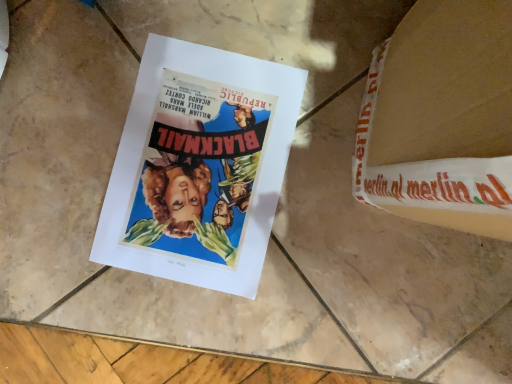
What do you see at coordinates (441, 118) in the screenshot? Image resolution: width=512 pixels, height=384 pixels. I see `white cardboard at upper right` at bounding box center [441, 118].

Where is `white cardboard at upper right`? The image size is (512, 384). white cardboard at upper right is located at coordinates (441, 118).

Describe the element at coordinates (199, 166) in the screenshot. I see `matte paper poster at center` at that location.

Based on the photo, what is the approximate height of matte paper poster at center?

It is 0.73 inches.

At what (x,y) coordinates should I click in order to perform the action: click on matte paper poster at center. Please return your answer as a coordinate pair (x, y). Looking at the image, I should click on (199, 166).

At what (x,y) coordinates should I click in order to perform the action: click on white cardboard at upper right. Please return your answer as a coordinate pair (x, y). This screenshot has height=384, width=512. Looking at the image, I should click on 441,118.

Considering the relative positions of matte paper poster at center and white cardboard at upper right in the image provided, is matte paper poster at center to the left or to the right of white cardboard at upper right?

matte paper poster at center is positioned on white cardboard at upper right's left side.

Is matte paper poster at center closer to the viewer compared to white cardboard at upper right?

No, it is behind white cardboard at upper right.

Is point (170, 107) closer to viewer compared to point (451, 149)?

No, it is behind (451, 149).

From the picture: From the image's perspective, is matte paper poster at center above white cardboard at upper right?

No, from the image's perspective, matte paper poster at center is not over white cardboard at upper right.

From a real-world perspective, between matte paper poster at center and white cardboard at upper right, who is vertically lower?

From a 3D spatial view, matte paper poster at center is below.

Considering the sizes of matte paper poster at center and white cardboard at upper right in the image, is matte paper poster at center wider or thinner than white cardboard at upper right?

matte paper poster at center is thinner than white cardboard at upper right.

Who is taller, matte paper poster at center or white cardboard at upper right?

white cardboard at upper right.

In the scene shown: Between matte paper poster at center and white cardboard at upper right, which one has smaller size?

matte paper poster at center is smaller.

Is matte paper poster at center inside the boundaries of white cardboard at upper right, or outside?

matte paper poster at center is located beyond the bounds of white cardboard at upper right.

From the picture: Is matte paper poster at center next to white cardboard at upper right and touching it?

No, matte paper poster at center is not next to white cardboard at upper right.

Is matte paper poster at center positioned with its back to white cardboard at upper right?

matte paper poster at center is not turned away from white cardboard at upper right.

How many degrees apart are the facing directions of matte paper poster at center and white cardboard at upper right?

2.58 degrees separate the facing orientations of matte paper poster at center and white cardboard at upper right.

How far apart are matte paper poster at center and white cardboard at upper right?

They are 7.97 inches apart.

The image size is (512, 384). I want to click on paperback book located above the matte paper poster at center (from the image's perspective), so click(441, 118).

Between white cardboard at upper right and matte paper poster at center, which one appears on the right side from the viewer's perspective?

Positioned to the right is white cardboard at upper right.

Is white cardboard at upper right behind matte paper poster at center?

No, white cardboard at upper right is in front of matte paper poster at center.

Between point (446, 22) and point (286, 139), which one is positioned in front?

The point (446, 22) is closer to the camera.

From the image's perspective, is white cardboard at upper right beneath matte paper poster at center?

No, from the image's perspective, white cardboard at upper right is not below matte paper poster at center.

From a real-world perspective, which object rests below the other?

From a 3D spatial view, matte paper poster at center is below.

Which of these two, white cardboard at upper right or matte paper poster at center, is thinner?

matte paper poster at center is thinner.

Considering the sizes of objects white cardboard at upper right and matte paper poster at center in the image provided, who is taller, white cardboard at upper right or matte paper poster at center?

With more height is white cardboard at upper right.

Who is bigger, white cardboard at upper right or matte paper poster at center?

Bigger between the two is white cardboard at upper right.

Could matte paper poster at center be considered to be inside white cardboard at upper right?

Actually, matte paper poster at center is outside white cardboard at upper right.

Is white cardboard at upper right not near matte paper poster at center?

They are positioned close to each other.

Consider the image. Is matte paper poster at center at the back of white cardboard at upper right?

That's not correct — white cardboard at upper right is not looking away from matte paper poster at center.

How many degrees apart are the facing directions of white cardboard at upper right and matte paper poster at center?

The angular difference between white cardboard at upper right and matte paper poster at center is 2.58 degrees.

Find the location of a particular element. paperback book lying above the matte paper poster at center (from the image's perspective) is located at coordinates (441, 118).

At what (x,y) coordinates should I click in order to perform the action: click on paperback book in front of the matte paper poster at center. Please return your answer as a coordinate pair (x, y). The width and height of the screenshot is (512, 384). Looking at the image, I should click on (441, 118).

Identify the location of poster behind the white cardboard at upper right. This screenshot has width=512, height=384. (199, 166).